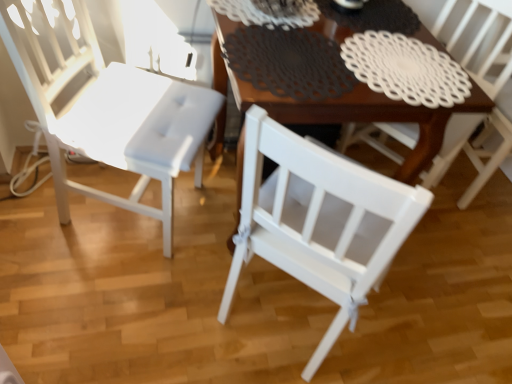
Question: From a real-world perspective, is wooden table at center physically located above or below white matte chair at center, the first chair when ordered from right to left?

Choices:
 (A) above
 (B) below

Answer: (B)

Question: In terms of size, does wooden table at center appear bigger or smaller than white matte chair at center, which is the 2th chair from left to right?

Choices:
 (A) small
 (B) big

Answer: (B)

Question: Estimate the real-world distances between objects in this image. Which object is closer to the white matte chair at center, the first chair when ordered from right to left?

Choices:
 (A) wooden table at center
 (B) white matte chair at left, the 2th chair when ordered from right to left

Answer: (A)

Question: Which object is positioned farthest from the white matte chair at left, marked as the 1th chair in a left-to-right arrangement?

Choices:
 (A) wooden table at center
 (B) white matte chair at center, which is the 2th chair from left to right

Answer: (B)